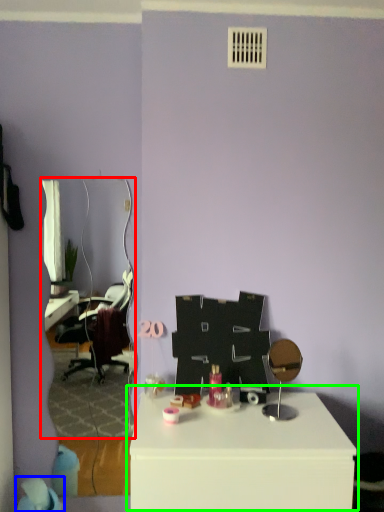
Question: Based on their relative distances, which object is farther from mirror (highlighted by a red box)? Choose from bean bag chair (highlighted by a blue box) and table (highlighted by a green box).

Choices:
 (A) bean bag chair
 (B) table

Answer: (B)